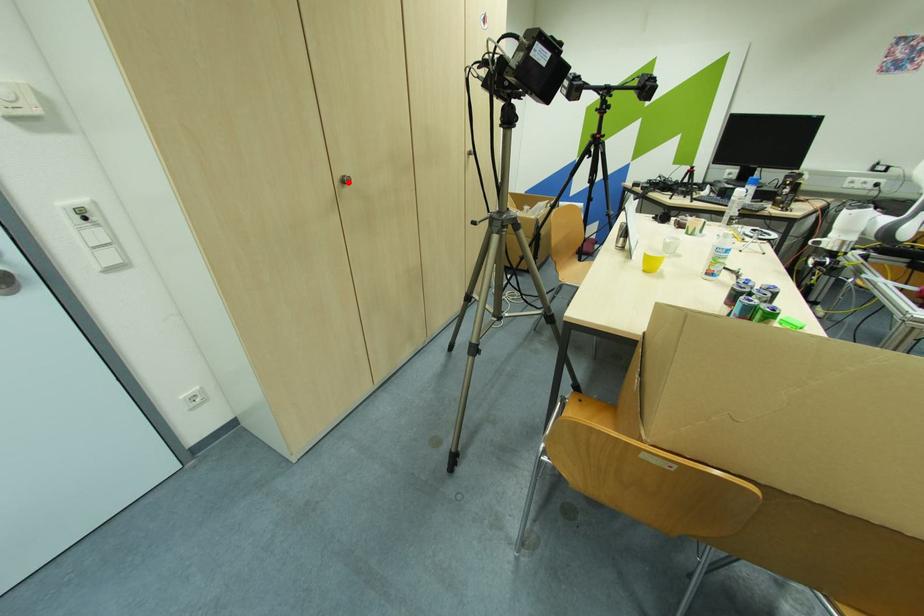
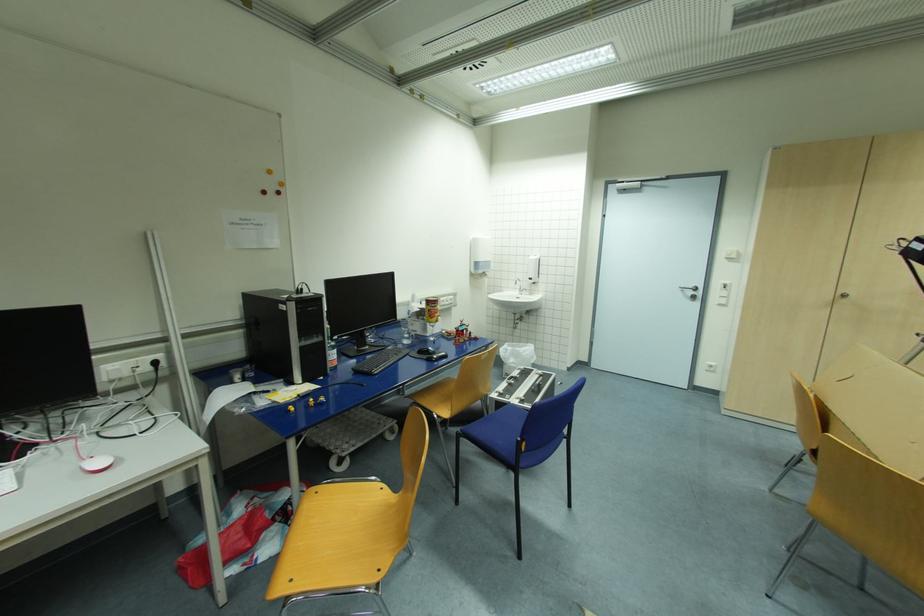
Locate, in the second image, the point that corresponds to the highlighted location in the first image.

(847, 296)